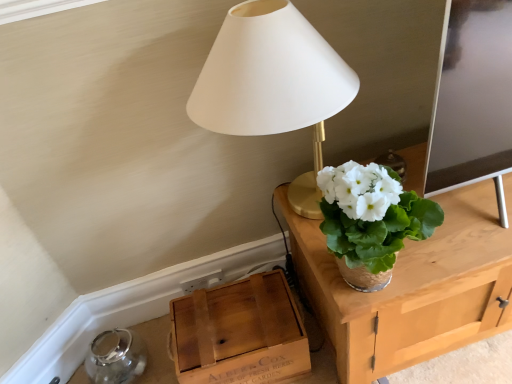
Measure the distance between woven straw vase at upper right and camera.

34.67 inches.

Locate an element on the screen. wooden crate at lower left is located at coordinates (239, 333).

Would you say wooden crate at lower left is to the left or to the right of white matte lampshade at upper center in the picture?

wooden crate at lower left is positioned on white matte lampshade at upper center's left side.

Looking at the image, does wooden crate at lower left seem bigger or smaller compared to white matte lampshade at upper center?

In the image, wooden crate at lower left appears to be smaller than white matte lampshade at upper center.

Does wooden crate at lower left turn towards white matte lampshade at upper center?

No, wooden crate at lower left is not facing towards white matte lampshade at upper center.

Looking at this image, which is less distant, (187,320) or (331,63)?

Point (187,320) is positioned farther from the camera compared to point (331,63).

Is wooden crate at lower left surrounded by white matte lampshade at upper center?

That's incorrect, wooden crate at lower left is not inside white matte lampshade at upper center.

In the image, is white matte lampshade at upper center on the left side or the right side of wooden crate at lower left?

white matte lampshade at upper center is positioned on wooden crate at lower left's right side.

Identify the location of cardboard box on the left side of white matte lampshade at upper center. This screenshot has height=384, width=512. (239, 333).

Is woven straw vase at upper right facing towards white matte lampshade at upper center?

No, woven straw vase at upper right does not turn towards white matte lampshade at upper center.

This screenshot has height=384, width=512. Find the location of `lamp that is above the woven straw vase at upper right (from the image's perspective)`. lamp that is above the woven straw vase at upper right (from the image's perspective) is located at coordinates (273, 84).

Which is less distant, [449,298] or [327,48]?

The point [327,48] is closer.

Locate an element on the screen. table positioned vertically above the wooden crate at lower left (from a real-world perspective) is located at coordinates (412, 287).

Is wooden crate at lower left to the left or to the right of woven straw vase at upper right in the image?

In the image, wooden crate at lower left appears on the left side of woven straw vase at upper right.

Does point (199, 379) come in front of point (393, 296)?

No.

How much distance is there between wooden crate at lower left and woven straw vase at upper right?

A distance of 11.78 inches exists between wooden crate at lower left and woven straw vase at upper right.

Locate an element on the screen. Image resolution: width=512 pixels, height=384 pixels. lamp that is above the woven straw vase at upper right (from a real-world perspective) is located at coordinates (273, 84).

Does white matte lampshade at upper center have a lesser height compared to woven straw vase at upper right?

Incorrect, the height of white matte lampshade at upper center does not fall short of that of woven straw vase at upper right.

Which point is more forward, (315, 204) or (347, 290)?

The point (347, 290) is more forward.

Considering the sizes of objects woven straw vase at upper right and wooden crate at lower left in the image provided, who is thinner, woven straw vase at upper right or wooden crate at lower left?

woven straw vase at upper right is thinner.

From a real-world perspective, is woven straw vase at upper right positioned over wooden crate at lower left based on gravity?

Answer: Yes.

Considering the relative sizes of woven straw vase at upper right and wooden crate at lower left in the image provided, is woven straw vase at upper right bigger than wooden crate at lower left?

No, woven straw vase at upper right is not bigger than wooden crate at lower left.

Is woven straw vase at upper right in contact with wooden crate at lower left?

No, woven straw vase at upper right is not with wooden crate at lower left.

Image resolution: width=512 pixels, height=384 pixels. Identify the location of cardboard box that is below the white matte lampshade at upper center (from the image's perspective). (239, 333).

I want to click on cardboard box behind the white matte lampshade at upper center, so click(239, 333).

Based on their spatial positions, is wooden crate at lower left or white matte lampshade at upper center closer to woven straw vase at upper right?

wooden crate at lower left.

Based on their spatial positions, is white matte lampshade at upper center or woven straw vase at upper right closer to wooden crate at lower left?

The object closer to wooden crate at lower left is woven straw vase at upper right.

Considering their positions, is woven straw vase at upper right positioned further to white matte lampshade at upper center than wooden crate at lower left?

Among the two, wooden crate at lower left is located further to white matte lampshade at upper center.

Estimate the real-world distances between objects in this image. Which object is closer to woven straw vase at upper right, white matte lampshade at upper center or wooden crate at lower left?

wooden crate at lower left is positioned closer to the anchor woven straw vase at upper right.

Based on their spatial positions, is wooden crate at lower left or woven straw vase at upper right closer to white matte lampshade at upper center?

woven straw vase at upper right lies closer to white matte lampshade at upper center than the other object.

When comparing their distances from wooden crate at lower left, does woven straw vase at upper right or white matte lampshade at upper center seem further?

white matte lampshade at upper center.

Identify the location of table between white matte lampshade at upper center and wooden crate at lower left from top to bottom. (412, 287).